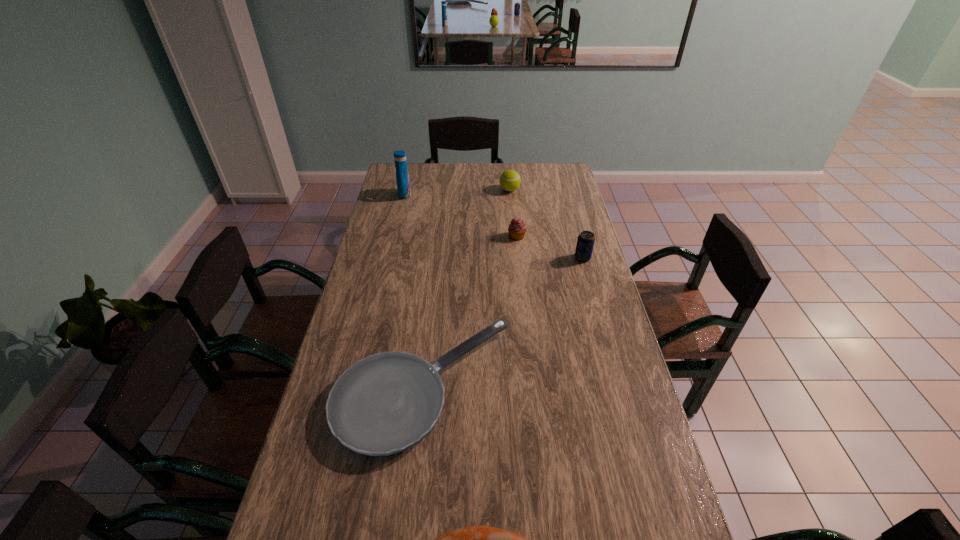
Find the location of a particular element. The width and height of the screenshot is (960, 540). vacant space located on the back of the frying pan is located at coordinates (437, 268).

You are a GUI agent. You are given a task and a screenshot of the screen. Output one action in this format:
    pyautogui.click(x=<x>, y=<y>)
    Task: Click on the object that is positioned at the far edge
    The width and height of the screenshot is (960, 540).
    Given the screenshot: What is the action you would take?
    pyautogui.click(x=510, y=180)

Identify the location of detergent that is at the left edge. (402, 177).

You are a GUI agent. You are given a task and a screenshot of the screen. Output one action in this format:
    pyautogui.click(x=<x>, y=<y>)
    Task: Click on the frying pan that is at the left edge
    This screenshot has height=540, width=960.
    Given the screenshot: What is the action you would take?
    pyautogui.click(x=384, y=404)

Locate an element on the screen. Image resolution: width=960 pixels, height=540 pixels. object located at the right edge is located at coordinates (585, 243).

Locate an element on the screen. The width and height of the screenshot is (960, 540). free space at the far edge is located at coordinates (461, 173).

In the image, there is a desktop. Find the location of `vacant space at the left edge`. vacant space at the left edge is located at coordinates (389, 293).

Identify the location of vacant region at the right edge of the desktop. The image size is (960, 540). (603, 286).

Where is `vacant space at the far left corner of the desktop`? The image size is (960, 540). vacant space at the far left corner of the desktop is located at coordinates (410, 170).

Locate an element on the screen. vacant space at the far right corner of the desktop is located at coordinates (538, 172).